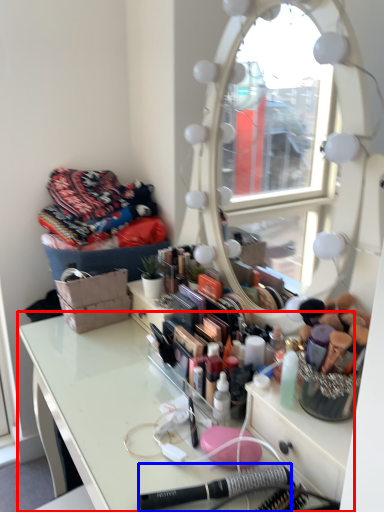
Question: Among these objects, which one is farthest to the camera, table (highlighted by a red box) or equipment (highlighted by a blue box)?

Choices:
 (A) table
 (B) equipment

Answer: (B)